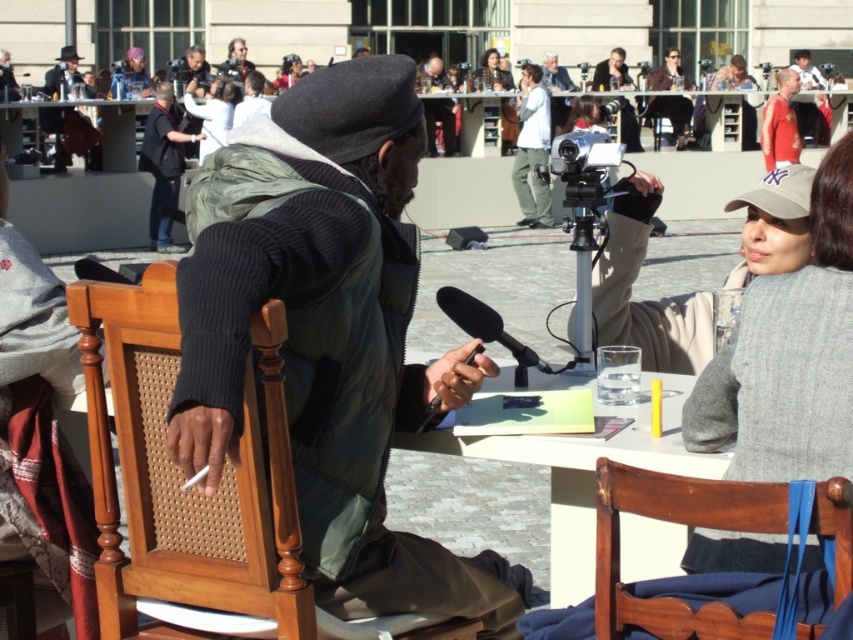
Does green fabric vest at center appear under matte black hat at upper left?

Indeed, green fabric vest at center is positioned under matte black hat at upper left.

Does green fabric vest at center have a greater width compared to matte black hat at upper left?

No, green fabric vest at center is not wider than matte black hat at upper left.

What do you see at coordinates (331, 339) in the screenshot? I see `green fabric vest at center` at bounding box center [331, 339].

Where is `green fabric vest at center`? green fabric vest at center is located at coordinates (331, 339).

How far apart are green fabric vest at center and wooden table at center?

green fabric vest at center is 87.17 feet from wooden table at center.

Can you confirm if green fabric vest at center is positioned to the left of wooden table at center?

Incorrect, green fabric vest at center is not on the left side of wooden table at center.

Who is more distant from viewer, (x=433, y=598) or (x=20, y=112)?

Point (x=20, y=112)

Where is `green fabric vest at center`? green fabric vest at center is located at coordinates (331, 339).

Between point (589, 259) and point (666, 52), which one is positioned behind?

Positioned behind is point (666, 52).

Between silver metallic video camera at center and matte black jacket at upper center, which one has more height?

matte black jacket at upper center is taller.

Is point (585, 262) in front of point (676, 115)?

Yes, it is in front of point (676, 115).

Where is `silver metallic video camera at center`? The height and width of the screenshot is (640, 853). silver metallic video camera at center is located at coordinates (582, 220).